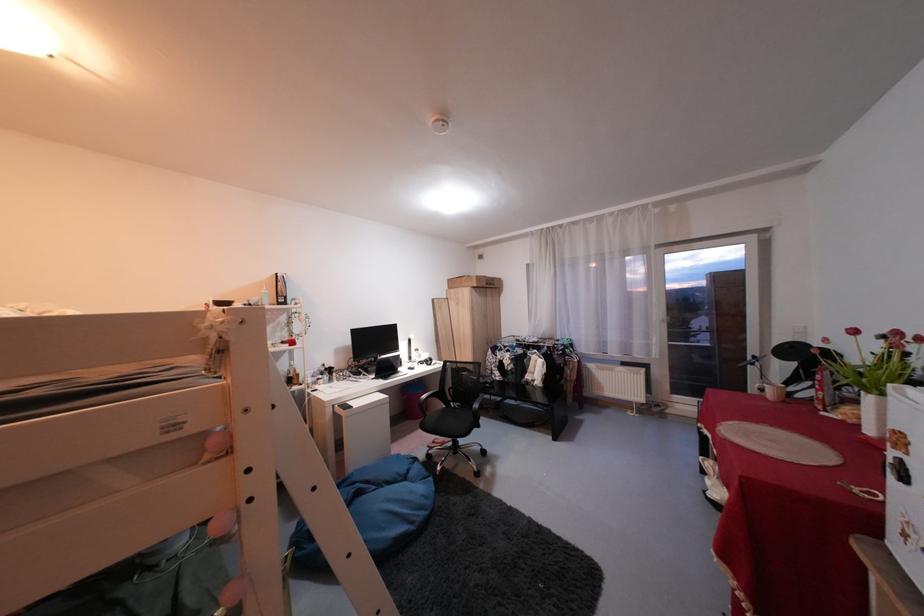
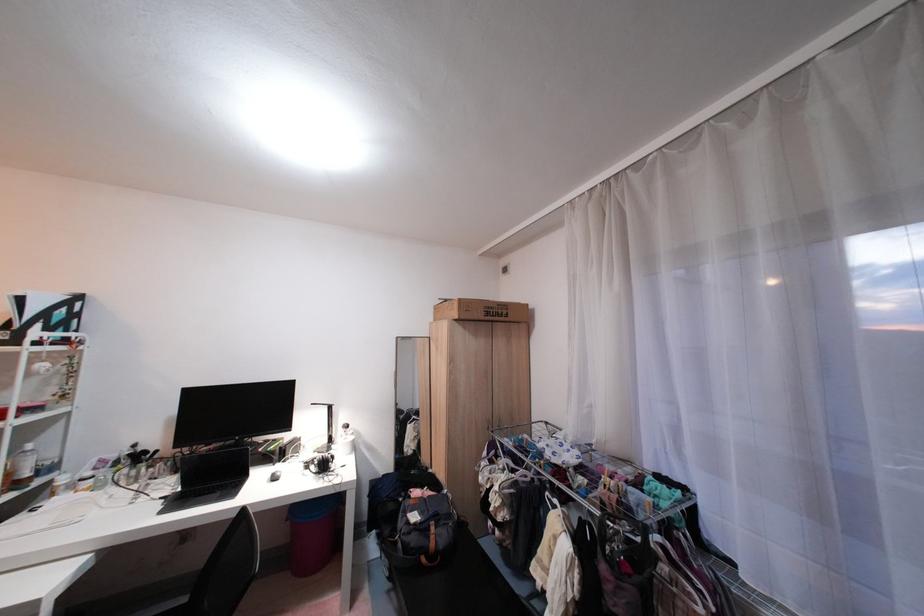
Find the pixel in the second image that matches (x=499, y=387) in the first image.

(434, 561)